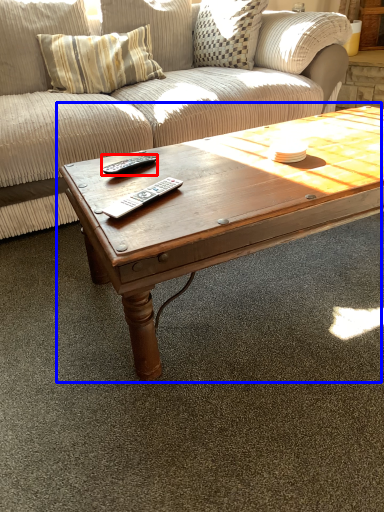
Question: Among these objects, which one is nearest to the camera, remote (highlighted by a red box) or coffee table (highlighted by a blue box)?

Choices:
 (A) remote
 (B) coffee table

Answer: (B)